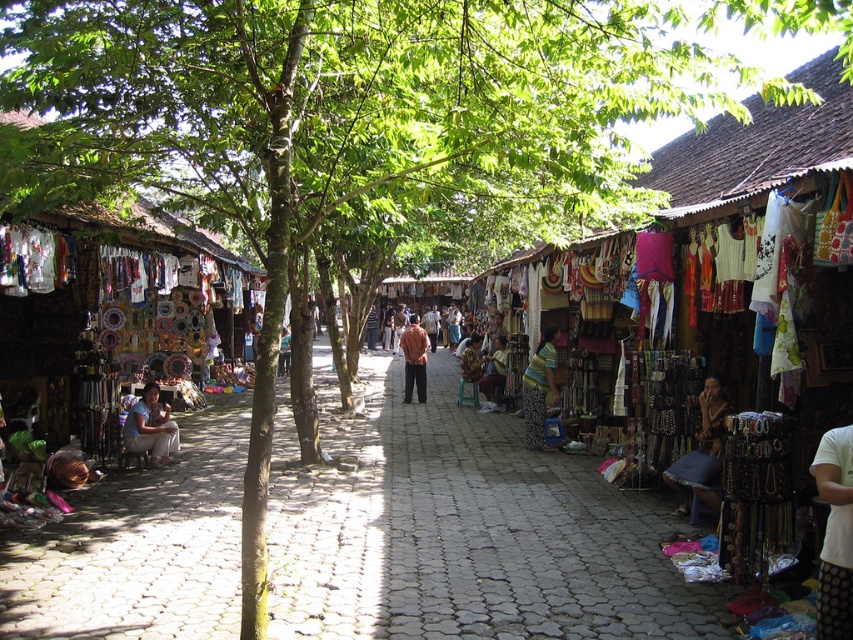
Question: Is matte brown shirt at center to the left of matte brown leather bag at center from the viewer's perspective?

Choices:
 (A) yes
 (B) no

Answer: (A)

Question: Which of the following is the closest to the observer?

Choices:
 (A) (138, 420)
 (B) (538, 369)

Answer: (A)

Question: Does white cotton shirt at lower right have a larger size compared to matte brown leather bag at center?

Choices:
 (A) no
 (B) yes

Answer: (A)

Question: Which point appears farthest from the camera in this image?

Choices:
 (A) (413, 355)
 (B) (550, 353)

Answer: (A)

Question: Is striped fabric skirt at center below matte white fabric at center?

Choices:
 (A) yes
 (B) no

Answer: (B)

Question: Based on their relative distances, which object is nearer to the matte white fabric at center?

Choices:
 (A) matte brown leather bag at center
 (B) matte brown shirt at center
 (C) white cotton shirt at lower right

Answer: (A)